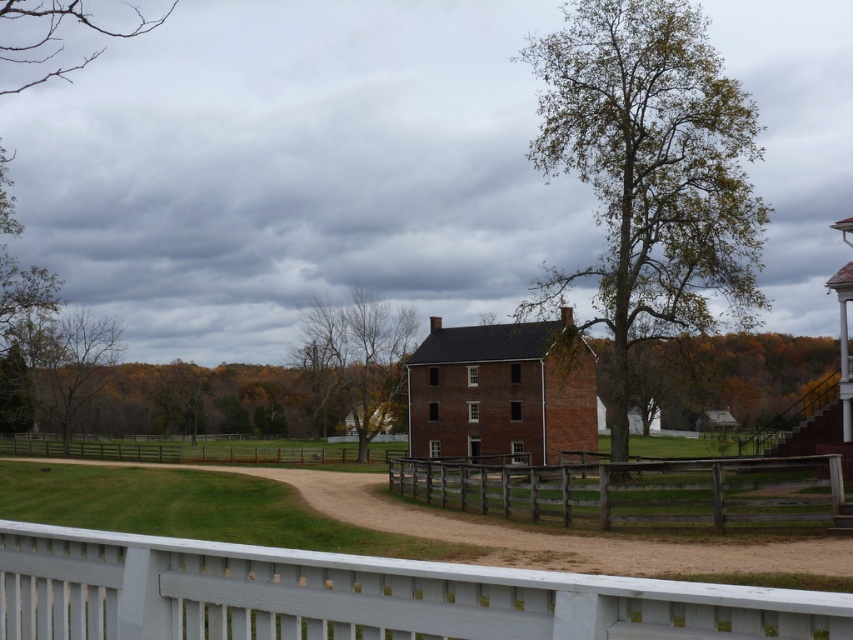
You are standing at the white wooden railing in the foreground of the image. You want to walk directly to the green leafy tree at center. Which direction should you head towards?

The green leafy tree at center is located at point 0.270 on the x axis and 0.762 on the y axis. Since you are at the white wooden railing in the foreground, which is the lower part of the image, you should move forward towards the center of the image to reach the green leafy tree at center.